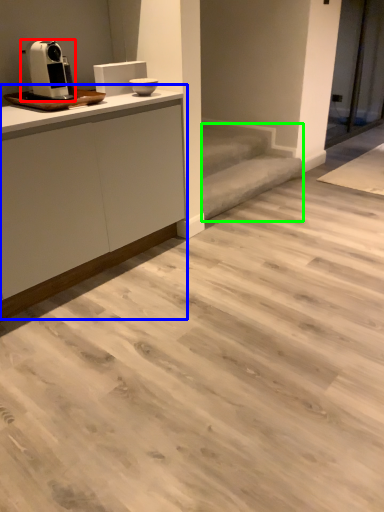
Question: Which is nearer to the home appliance (highlighted by a red box)? cabinetry (highlighted by a blue box) or stair (highlighted by a green box).

Choices:
 (A) cabinetry
 (B) stair

Answer: (A)